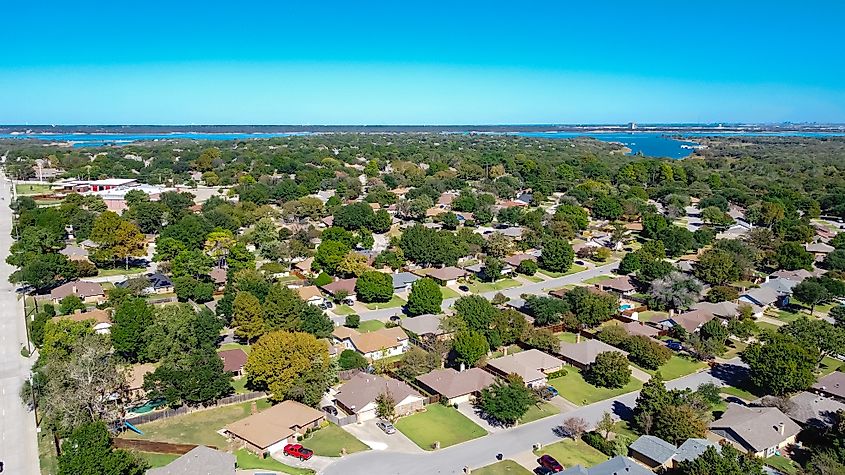
You are a GUI agent. You are given a task and a screenshot of the screen. Output one action in this format:
    pyautogui.click(x=<x>, y=<y>)
    Task: Click on the chimney
    Image resolution: width=845 pixels, height=475 pixels.
    Given the screenshot: What is the action you would take?
    pyautogui.click(x=254, y=407)